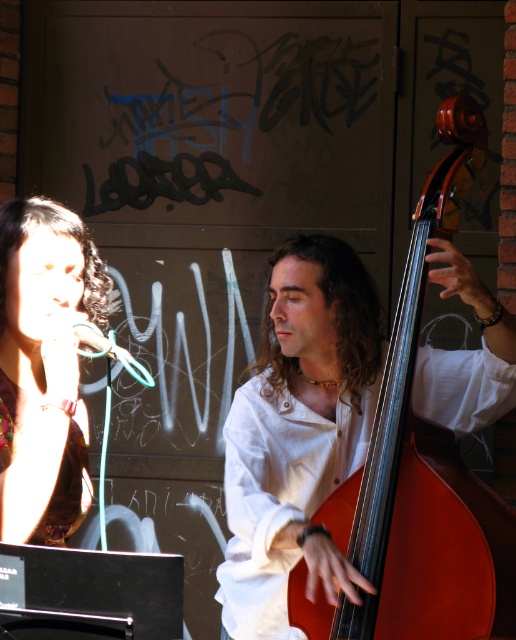
Question: Which of the following is the farthest from the observer?

Choices:
 (A) matte brown hair at upper left
 (B) shiny brown wood cello at right

Answer: (B)

Question: Considering the relative positions of shiny brown wood cello at right and matte brown hair at upper left in the image provided, where is shiny brown wood cello at right located with respect to matte brown hair at upper left?

Choices:
 (A) left
 (B) right

Answer: (B)

Question: Can you confirm if shiny brown wood cello at right is positioned below matte brown hair at upper left?

Choices:
 (A) yes
 (B) no

Answer: (B)

Question: Is shiny brown wood cello at right above matte brown hair at upper left?

Choices:
 (A) yes
 (B) no

Answer: (A)

Question: Among these objects, which one is nearest to the camera?

Choices:
 (A) matte brown hair at upper left
 (B) shiny brown wood cello at right

Answer: (A)